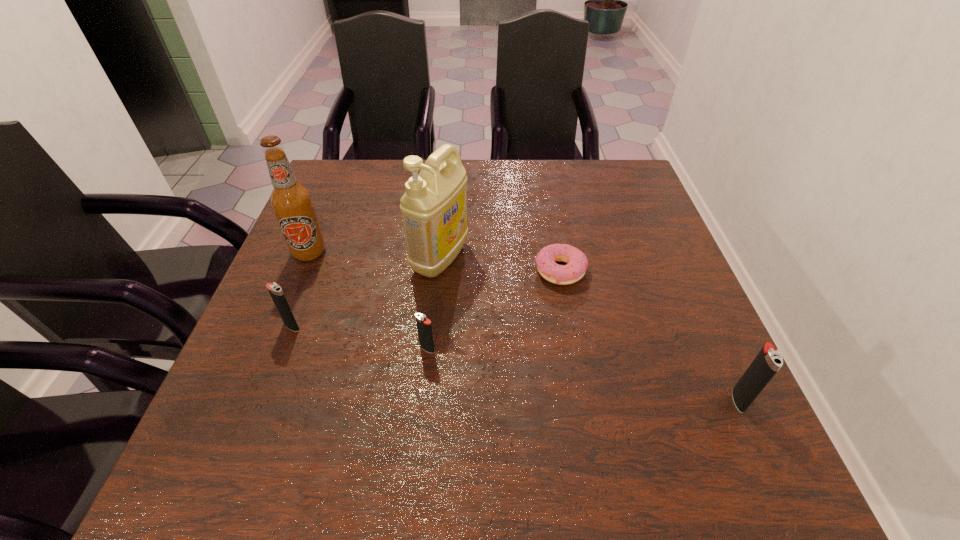
Image resolution: width=960 pixels, height=540 pixels. Identify the location of blank region between the detergent and the doughnut. (500, 264).

Where is `free space that is in between the doughnut and the second nearest object`? free space that is in between the doughnut and the second nearest object is located at coordinates (493, 310).

The image size is (960, 540). What are the coordinates of `free space between the rightmost igniter and the farthest igniter` in the screenshot? It's located at (516, 363).

You are a GUI agent. You are given a task and a screenshot of the screen. Output one action in this format:
    pyautogui.click(x=<x>, y=<y>)
    Task: Click on the vacant region between the rightmost object and the beer bottle
    
    Given the screenshot: What is the action you would take?
    pyautogui.click(x=524, y=326)

Find the location of a particular element. This screenshot has width=960, height=540. free space that is in between the third nearest object and the doughnut is located at coordinates (426, 299).

Image resolution: width=960 pixels, height=540 pixels. I want to click on vacant area that lies between the detergent and the tallest igniter, so click(x=589, y=329).

Identify the location of object that is the third closest to the detergent. The height and width of the screenshot is (540, 960). (291, 201).

Locate which object is the fifth closest to the beer bottle. Please provide its 2D coordinates. Your answer should be formatted as a tuple, i.e. [(x, y)], where the tuple contains the x and y coordinates of a point satisfying the conditions above.

[(766, 364)]

Point out which igniter is positioned as the third nearest to the beer bottle. Please provide its 2D coordinates. Your answer should be formatted as a tuple, i.e. [(x, y)], where the tuple contains the x and y coordinates of a point satisfying the conditions above.

[(766, 364)]

Locate which igniter ranks in proximity to the nearest igniter. Please provide its 2D coordinates. Your answer should be formatted as a tuple, i.e. [(x, y)], where the tuple contains the x and y coordinates of a point satisfying the conditions above.

[(424, 327)]